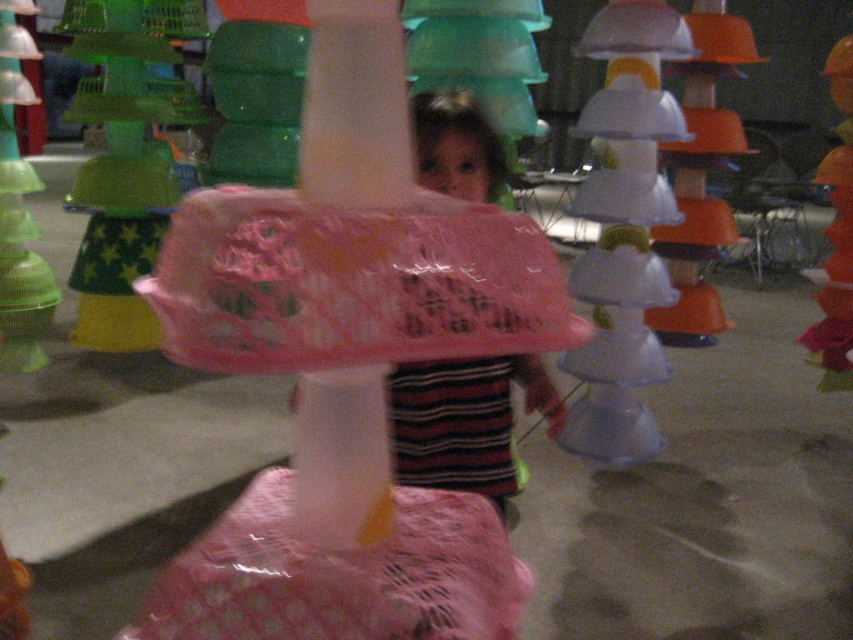
Is pink lace umbrella at center positioned before orange matte plastic bowl at upper right?

That is False.

Between pink lace umbrella at center and orange matte plastic bowl at upper right, which one appears on the left side from the viewer's perspective?

pink lace umbrella at center is more to the left.

Who is more forward, (131, 323) or (689, 128)?

Point (689, 128)

The image size is (853, 640). I want to click on pink lace umbrella at center, so click(x=120, y=182).

Is translucent white mushroom at center positioned before pink lace umbrella at center?

Yes, it is in front of pink lace umbrella at center.

Which is more to the right, translucent white mushroom at center or pink lace umbrella at center?

From the viewer's perspective, translucent white mushroom at center appears more on the right side.

The image size is (853, 640). I want to click on translucent white mushroom at center, so click(624, 228).

Between translucent white mushroom at center and pink plastic bag at center, which one is positioned lower?

pink plastic bag at center

Between translucent white mushroom at center and pink plastic bag at center, which one has more height?

translucent white mushroom at center

What do you see at coordinates (624, 228) in the screenshot?
I see `translucent white mushroom at center` at bounding box center [624, 228].

The height and width of the screenshot is (640, 853). I want to click on translucent white mushroom at center, so click(x=624, y=228).